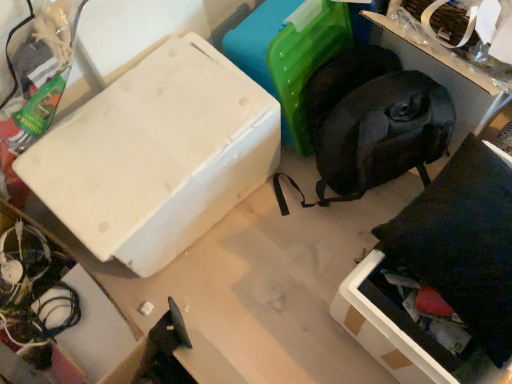
Question: Is white matte box at upper left thinner than white matte cardboard box at lower left?

Choices:
 (A) yes
 (B) no

Answer: (A)

Question: Is white matte box at upper left wider than white matte cardboard box at lower left?

Choices:
 (A) no
 (B) yes

Answer: (A)

Question: Does white matte box at upper left have a smaller size compared to white matte cardboard box at lower left?

Choices:
 (A) yes
 (B) no

Answer: (A)

Question: Is white matte cardboard box at lower left a part of white matte box at upper left?

Choices:
 (A) no
 (B) yes

Answer: (A)

Question: Does white matte box at upper left have a lesser height compared to white matte cardboard box at lower left?

Choices:
 (A) no
 (B) yes

Answer: (B)

Question: Can you confirm if white matte box at upper left is positioned to the right of white matte cardboard box at lower left?

Choices:
 (A) yes
 (B) no

Answer: (A)

Question: Does white matte cardboard box at lower left appear on the right side of white matte box at upper left?

Choices:
 (A) no
 (B) yes

Answer: (A)

Question: Could you tell me if white matte cardboard box at lower left is facing white matte box at upper left?

Choices:
 (A) yes
 (B) no

Answer: (A)

Question: From a real-world perspective, does white matte cardboard box at lower left stand above white matte box at upper left?

Choices:
 (A) yes
 (B) no

Answer: (A)

Question: Could white matte box at upper left be considered to be inside white matte cardboard box at lower left?

Choices:
 (A) no
 (B) yes

Answer: (A)

Question: From a real-world perspective, is white matte cardboard box at lower left physically below white matte box at upper left?

Choices:
 (A) no
 (B) yes

Answer: (A)

Question: Is white matte cardboard box at lower left thinner than white matte box at upper left?

Choices:
 (A) no
 (B) yes

Answer: (A)

Question: From the image's perspective, would you say white matte cardboard box at lower left is positioned over black fabric bag at upper right?

Choices:
 (A) no
 (B) yes

Answer: (A)